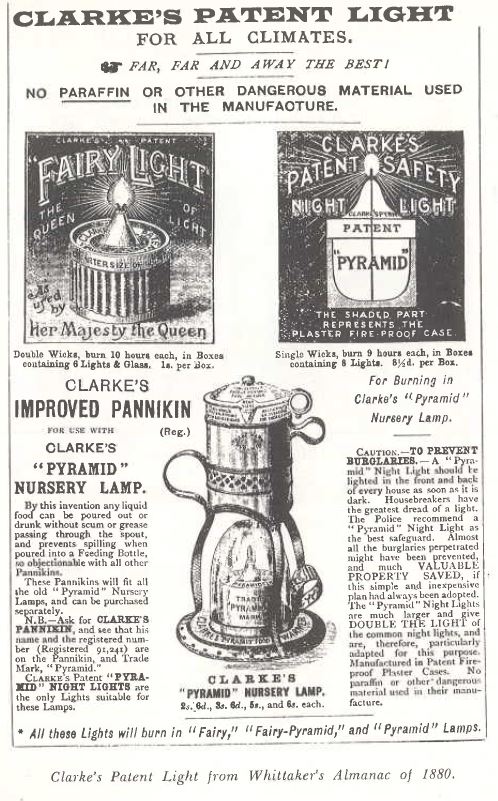
Locate an element on the screen. The image size is (498, 801). pyramid night light lamp is located at coordinates (369, 216).